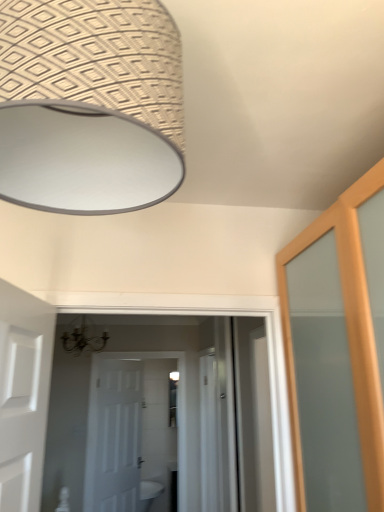
Question: Should I look upward or downward to see white matte door at center?

Choices:
 (A) down
 (B) up

Answer: (A)

Question: Can you confirm if white matte door at center is shorter than white glossy sink at lower center?

Choices:
 (A) no
 (B) yes

Answer: (A)

Question: From a real-world perspective, is white matte door at center physically below white glossy sink at lower center?

Choices:
 (A) no
 (B) yes

Answer: (A)

Question: Is white matte door at center located outside white glossy sink at lower center?

Choices:
 (A) no
 (B) yes

Answer: (B)

Question: Is white matte door at center in front of white glossy sink at lower center?

Choices:
 (A) no
 (B) yes

Answer: (B)

Question: From a real-world perspective, is white matte door at center located higher than white glossy sink at lower center?

Choices:
 (A) no
 (B) yes

Answer: (B)

Question: Would you say white glossy sink at lower center is part of white matte door at center's contents?

Choices:
 (A) yes
 (B) no

Answer: (B)

Question: From the image's perspective, would you say white glossy sink at lower center is positioned over white matte door at center?

Choices:
 (A) yes
 (B) no

Answer: (B)

Question: Does white glossy sink at lower center have a lesser width compared to white matte door at center?

Choices:
 (A) no
 (B) yes

Answer: (A)

Question: Can you confirm if white glossy sink at lower center is shorter than white matte door at center?

Choices:
 (A) yes
 (B) no

Answer: (A)

Question: Considering the relative sizes of white glossy sink at lower center and white matte door at center in the image provided, is white glossy sink at lower center smaller than white matte door at center?

Choices:
 (A) yes
 (B) no

Answer: (B)

Question: Is white glossy sink at lower center closer to camera compared to white matte door at center?

Choices:
 (A) no
 (B) yes

Answer: (A)

Question: Is white matte door at center at the back of white glossy sink at lower center?

Choices:
 (A) no
 (B) yes

Answer: (A)

Question: From a real-world perspective, does white glossy screen door at center stand above white glossy sink at lower center?

Choices:
 (A) yes
 (B) no

Answer: (A)